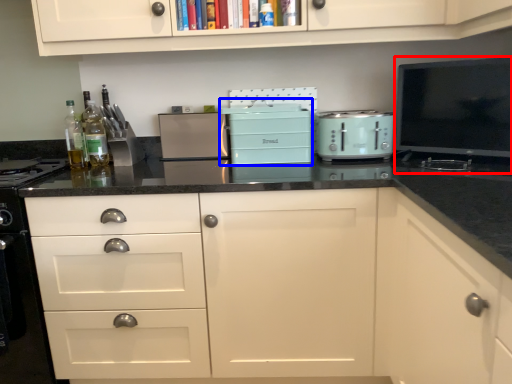
Question: Which object appears farthest to the camera in this image, appliance (highlighted by a red box) or appliance (highlighted by a blue box)?

Choices:
 (A) appliance
 (B) appliance

Answer: (B)